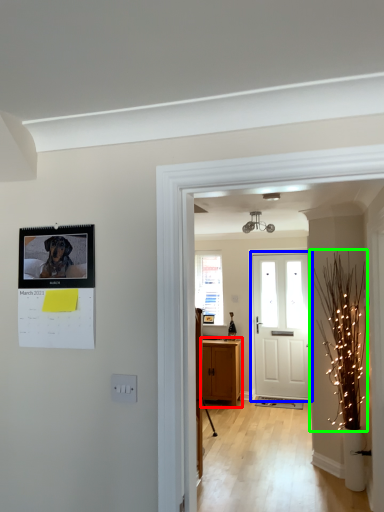
Question: Based on their relative distances, which object is farther from cabinetry (highlighted by a red box)? Choose from door (highlighted by a blue box) and christmas light (highlighted by a green box).

Choices:
 (A) door
 (B) christmas light

Answer: (B)